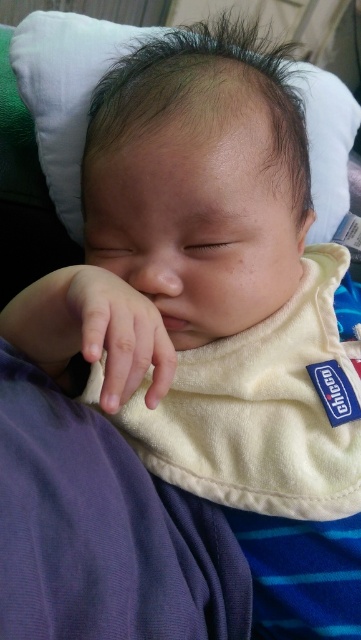
Who is lower down, white soft pillow at upper center or smooth skin hand at center?

Positioned lower is smooth skin hand at center.

Is point (312, 179) behind point (132, 355)?

Yes, point (312, 179) is behind point (132, 355).

Where is `white soft pillow at upper center`? The image size is (361, 640). white soft pillow at upper center is located at coordinates (66, 92).